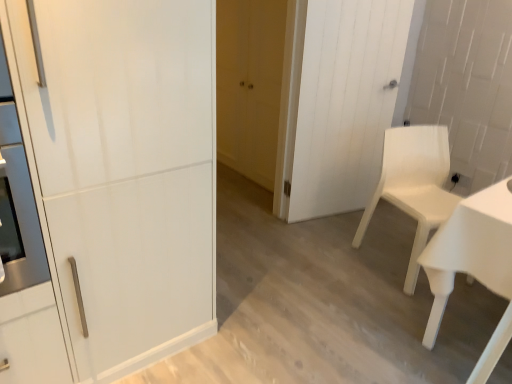
Where is `free space to the left of white plastic chair at right`? The image size is (512, 384). free space to the left of white plastic chair at right is located at coordinates point(335,264).